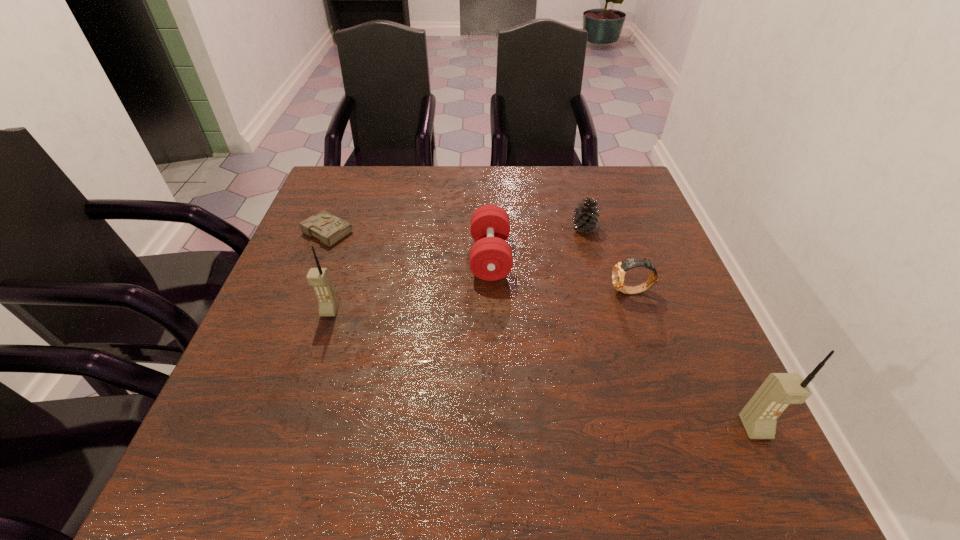
Identify the location of free space that satisfies the following two spatial constraints: 1. on the face of the watch; 2. on the front of the second tallest object, where the keypad is located. This screenshot has height=540, width=960. 637,310.